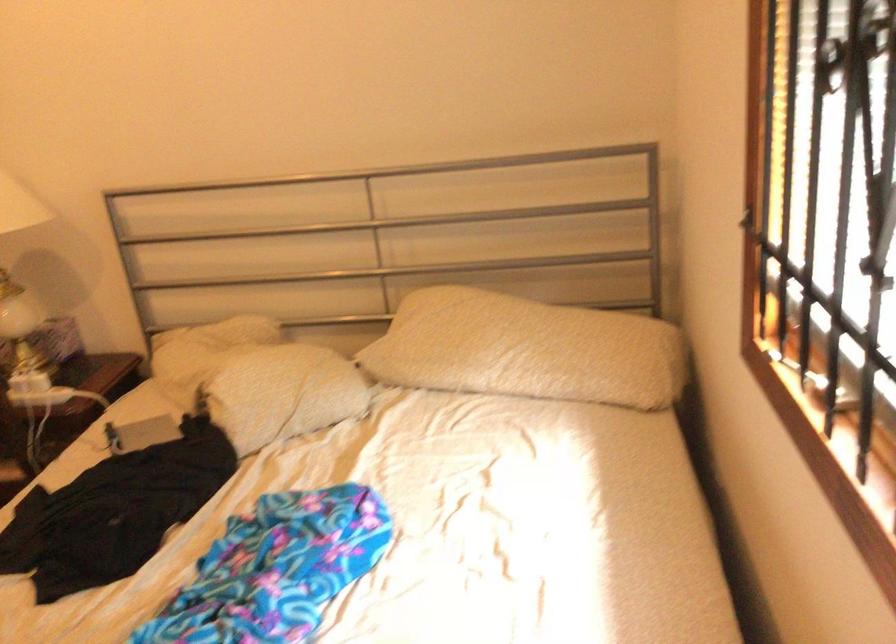
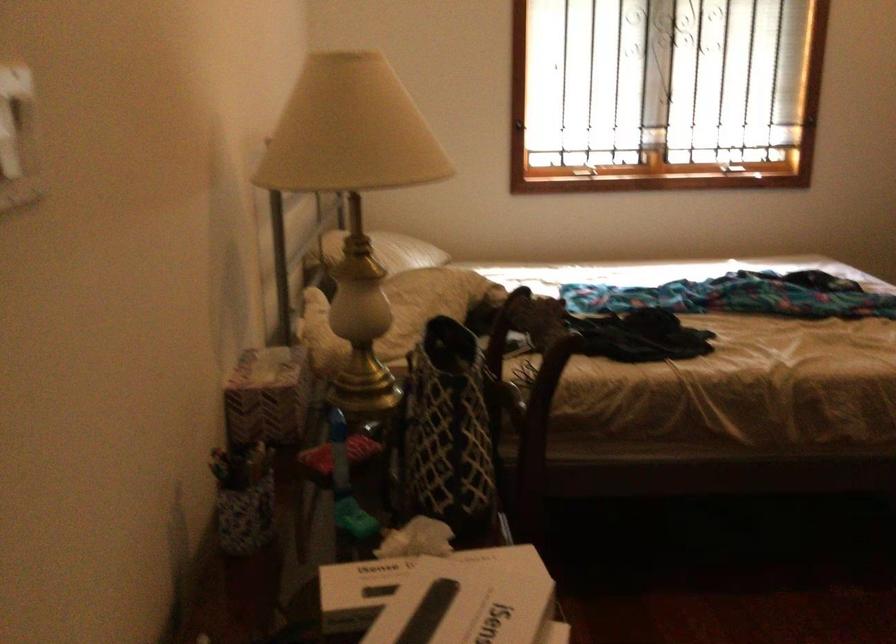
Locate, in the second image, the point that corresponds to (464,333) in the first image.

(388, 251)